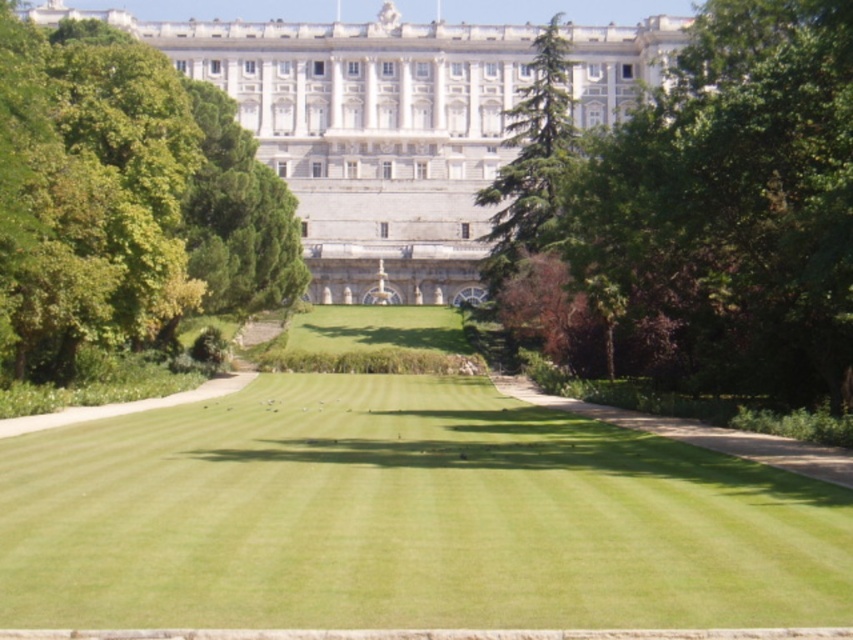
Question: Which of the following is the closest to the observer?

Choices:
 (A) white stone palace at upper center
 (B) green grass at center

Answer: (B)

Question: Which of the following is the closest to the observer?

Choices:
 (A) (602, 480)
 (B) (753, 154)

Answer: (A)

Question: Considering the relative positions of green leafy tree at upper left and white stone palace at upper center in the image provided, where is green leafy tree at upper left located with respect to white stone palace at upper center?

Choices:
 (A) above
 (B) below

Answer: (B)

Question: Does green grass at center have a lesser width compared to white stone palace at upper center?

Choices:
 (A) yes
 (B) no

Answer: (A)

Question: Does green leafy tree at upper left appear on the left side of white stone palace at upper center?

Choices:
 (A) no
 (B) yes

Answer: (B)

Question: Which of the following is the farthest from the observer?

Choices:
 (A) (469, 97)
 (B) (315, 396)
 (C) (244, 205)
 (D) (843, 312)

Answer: (A)